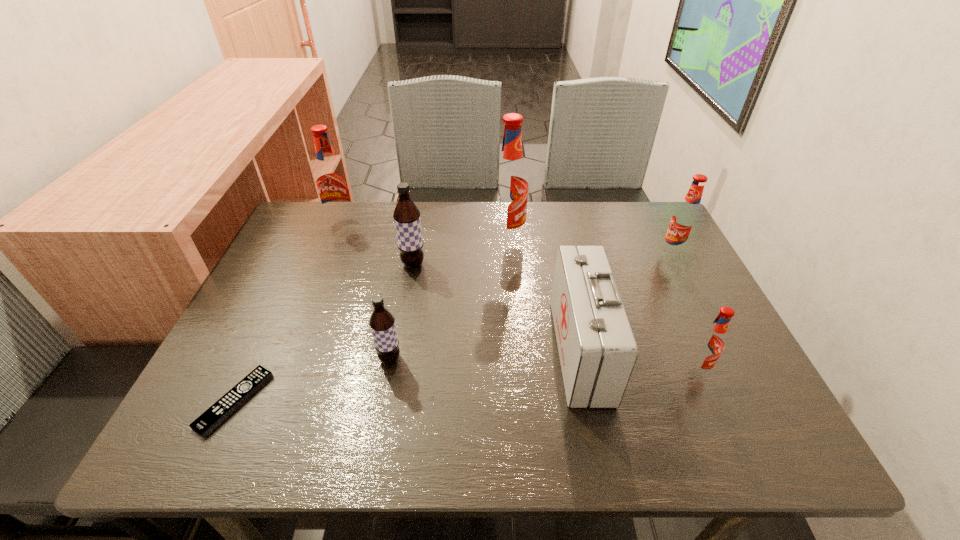
The image size is (960, 540). Find the location of `the third red root beer from left to right`. the third red root beer from left to right is located at coordinates (710, 344).

Find the location of a particular element. the smallest red root beer is located at coordinates (710, 344).

In order to click on the shortest object in this screenshot , I will do `click(234, 398)`.

Where is `blank area located on the front of the biggest red root beer`? The width and height of the screenshot is (960, 540). blank area located on the front of the biggest red root beer is located at coordinates (514, 329).

Where is `vacant space situated on the front of the second tallest root beer`? The height and width of the screenshot is (540, 960). vacant space situated on the front of the second tallest root beer is located at coordinates (310, 302).

Locate an element on the screen. The height and width of the screenshot is (540, 960). vacant point located 0.340m on the front of the rightmost red root beer is located at coordinates (730, 366).

Locate an element on the screen. vacant area situated 0.120m on the left of the farther brown root beer is located at coordinates pyautogui.click(x=355, y=264).

Where is `free space located 0.290m on the front-facing side of the red first-aid kit`? This screenshot has width=960, height=540. free space located 0.290m on the front-facing side of the red first-aid kit is located at coordinates (425, 350).

Where is `vacant position located on the front-facing side of the red first-aid kit`? vacant position located on the front-facing side of the red first-aid kit is located at coordinates (439, 350).

Find the location of a particular element. The height and width of the screenshot is (540, 960). free space located 0.390m on the front-facing side of the red first-aid kit is located at coordinates (379, 350).